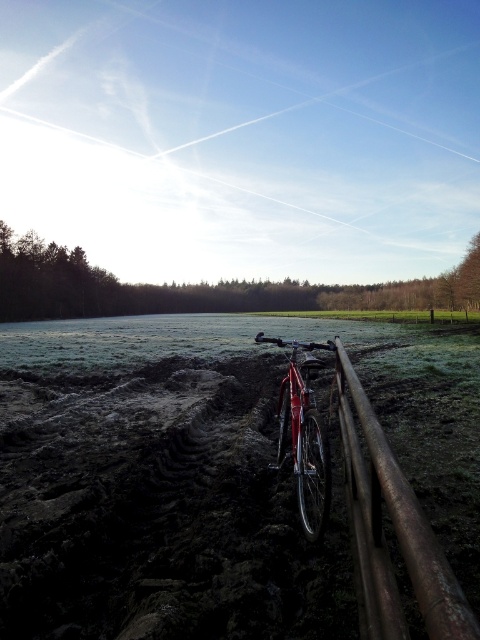
Is rusty metal fence at lower right smaller than shiny red bicycle at center?

Yes, rusty metal fence at lower right is smaller than shiny red bicycle at center.

Between rusty metal fence at lower right and shiny red bicycle at center, which one appears on the left side from the viewer's perspective?

From the viewer's perspective, rusty metal fence at lower right appears more on the left side.

Is point (345, 406) positioned behind point (316, 515)?

That is True.

In order to click on rusty metal fence at lower right in this screenshot , I will do `click(394, 529)`.